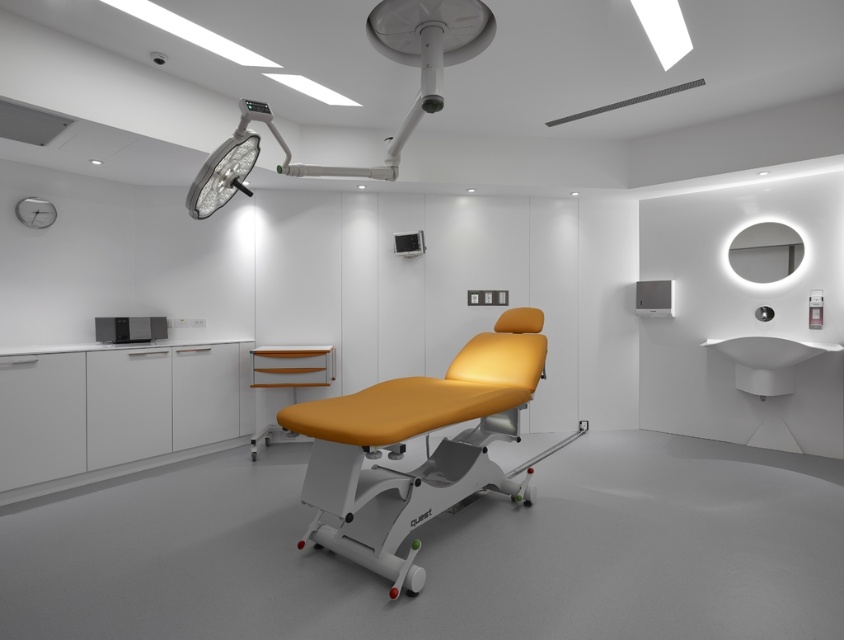
You are a patient entering the examination room and see the matte orange leather chair at center and the matte black monitor at lower left. Which object would you estimate to be larger in size?

The matte orange leather chair at center is bigger than the matte black monitor at lower left, so the matte orange leather chair at center is larger in size.

You are a patient entering the examination room and need to sit down. Which object, the matte orange leather chair at center or the matte white surgical light at upper center, is more appropriate for you to sit on?

The matte orange leather chair at center is more appropriate for sitting because it is much taller than the matte white surgical light at upper center, which is a light fixture and not meant for sitting.

You are a patient entering the room and need to sit down. The matte orange leather chair at center and the matte black monitor at lower left are in your path. Which object is wider, and should you adjust your path to avoid collision?

The matte orange leather chair at center is wider than the matte black monitor at lower left. To avoid collision, adjust your path to go around the wider matte orange leather chair at center.